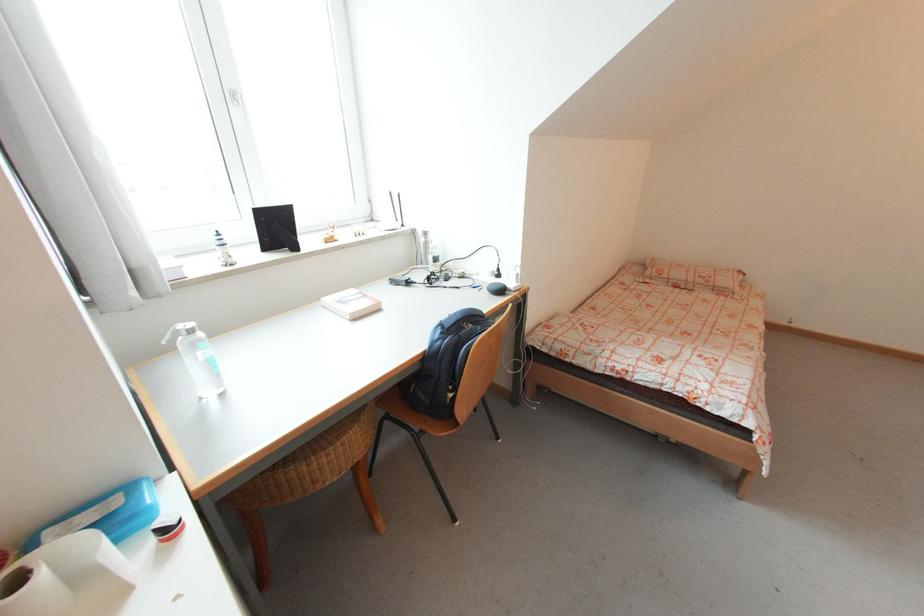
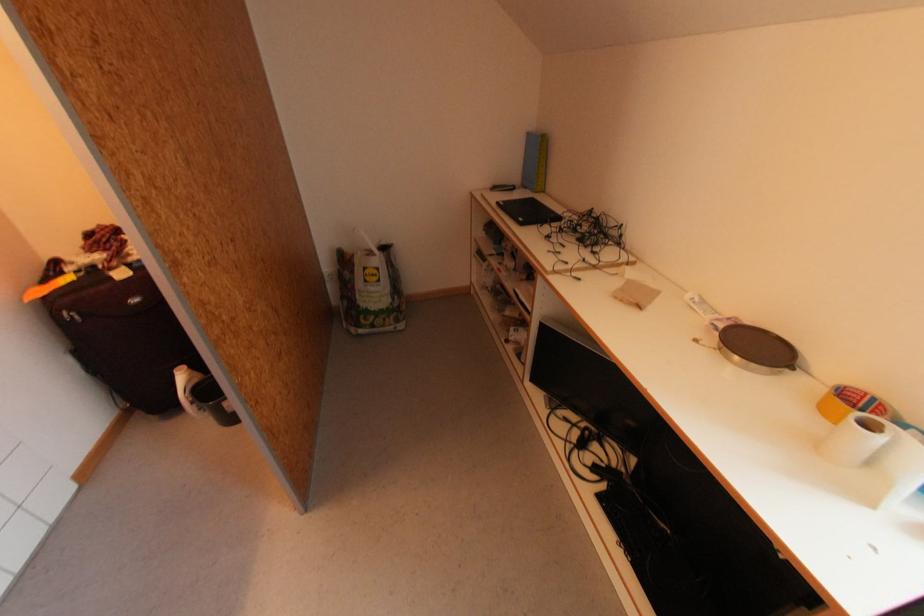
In the second image, find the point that corresponds to point (46, 575) in the first image.

(886, 439)